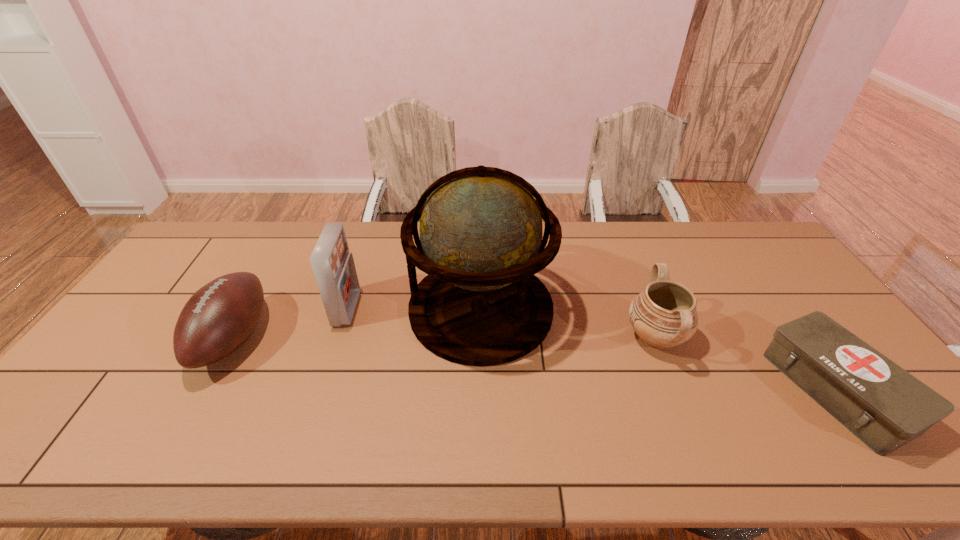
Locate an element on the screen. The image size is (960, 540). vacant area that lies between the football (American) and the shorter first-aid kit is located at coordinates (536, 364).

Locate an element on the screen. Image resolution: width=960 pixels, height=540 pixels. the closest object relative to the farther first-aid kit is located at coordinates (481, 244).

The height and width of the screenshot is (540, 960). I want to click on object identified as the third closest to the third object from left to right, so click(218, 318).

The image size is (960, 540). What are the coordinates of `blank space that satisfies the following two spatial constraints: 1. on the front-facing side of the farther first-aid kit; 2. on the right side of the rightmost object` in the screenshot? It's located at (321, 390).

Where is `free space that satisfies the following two spatial constraints: 1. on the front-facing side of the nearer first-aid kit; 2. on the left side of the taller first-aid kit`? free space that satisfies the following two spatial constraints: 1. on the front-facing side of the nearer first-aid kit; 2. on the left side of the taller first-aid kit is located at coordinates (321, 390).

The image size is (960, 540). What are the coordinates of `vacant space that satisfies the following two spatial constraints: 1. on the front-facing side of the tallest object; 2. on the left side of the shorter first-aid kit` in the screenshot? It's located at (481, 390).

Locate an element on the screen. Image resolution: width=960 pixels, height=540 pixels. free location that satisfies the following two spatial constraints: 1. on the back side of the rightmost object; 2. on the front-facing side of the globe is located at coordinates (780, 309).